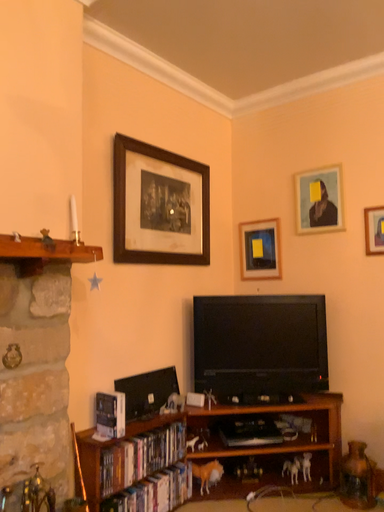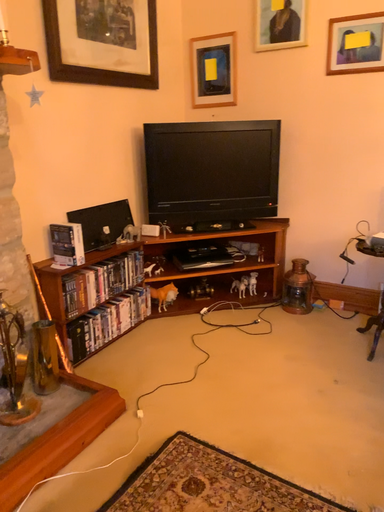
Question: How did the camera likely rotate when shooting the video?

Choices:
 (A) rotated downward
 (B) rotated upward

Answer: (A)